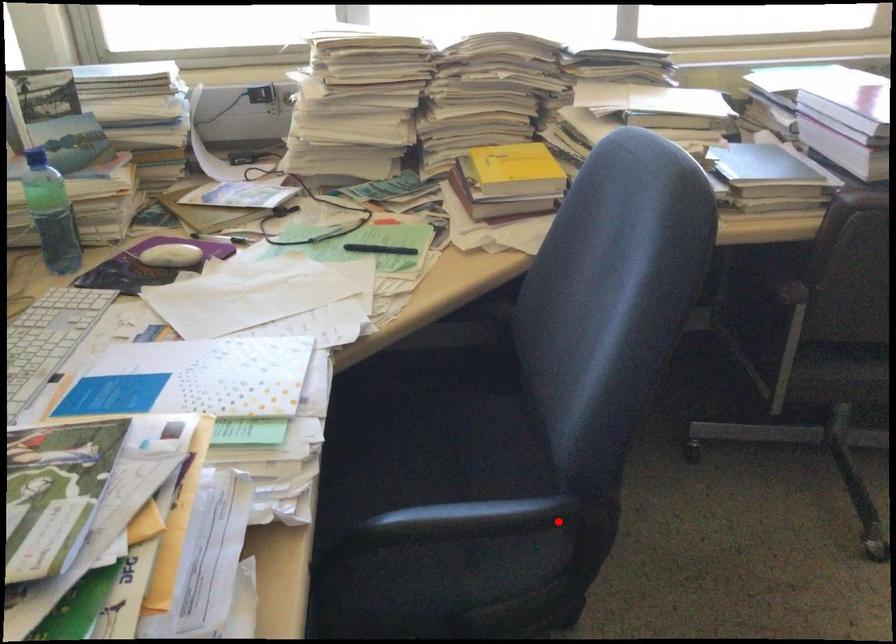
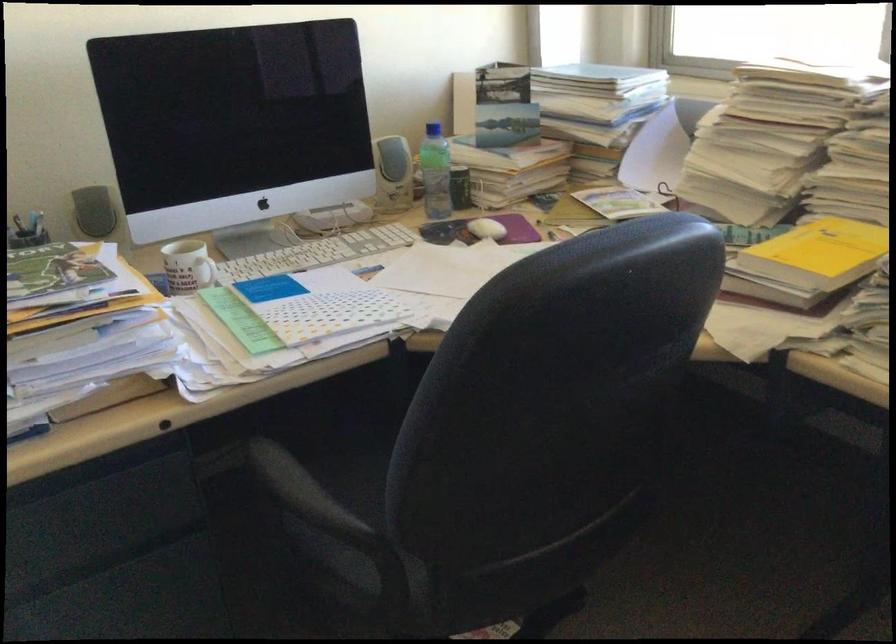
Locate, in the second image, the point that corresponds to the highlighted location in the first image.

(314, 521)